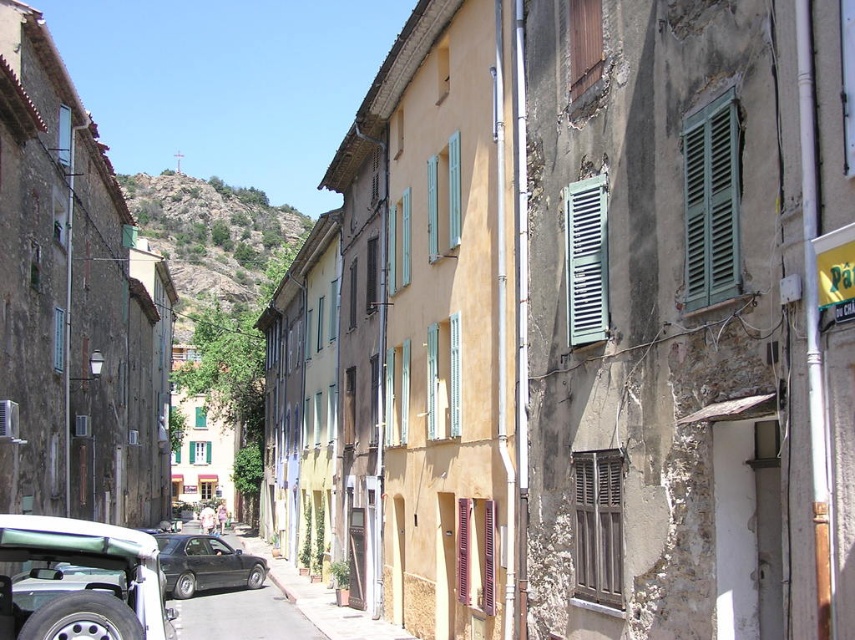
Question: Which of the following is the farthest from the observer?

Choices:
 (A) (575, 310)
 (B) (435, 324)

Answer: (B)

Question: Is wooden shutters at center to the left of shiny black sedan at center from the viewer's perspective?

Choices:
 (A) no
 (B) yes

Answer: (A)

Question: Does green wooden shutters at upper right have a lesser width compared to shiny black sedan at center?

Choices:
 (A) yes
 (B) no

Answer: (A)

Question: Which object appears closest to the camera in this image?

Choices:
 (A) brown wooden shutter at upper center
 (B) green rocky hillside at upper center

Answer: (A)

Question: From the image, what is the correct spatial relationship of silver metallic jeep at lower left in relation to brown wooden shutter at upper center?

Choices:
 (A) below
 (B) above

Answer: (A)

Question: Which point appears farthest from the camera in this image?

Choices:
 (A) (252, 557)
 (B) (255, 227)

Answer: (B)